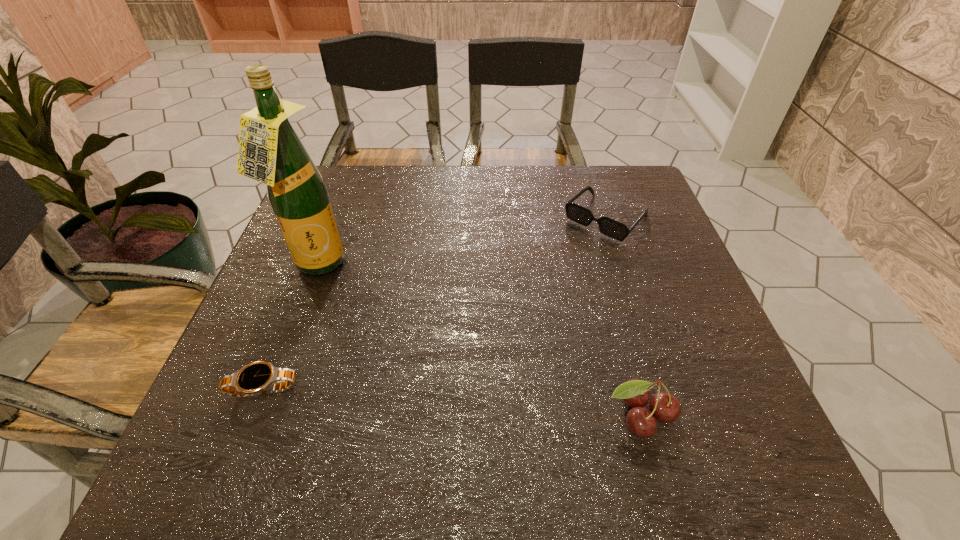
I want to click on object located at the near right corner, so click(x=665, y=407).

Find the location of a particular element. free region at the far edge of the desktop is located at coordinates (471, 212).

The image size is (960, 540). In the image, there is a desktop. Find the location of `vacant space at the near edge`. vacant space at the near edge is located at coordinates (403, 399).

The height and width of the screenshot is (540, 960). I want to click on blank space at the left edge of the desktop, so (351, 218).

Locate an element on the screen. The height and width of the screenshot is (540, 960). free location at the right edge of the desktop is located at coordinates (715, 364).

At what (x,y) coordinates should I click in order to perform the action: click on blank area at the far left corner. Please return your answer as a coordinate pair (x, y). The image size is (960, 540). Looking at the image, I should click on (367, 183).

Where is `free space at the far right corner of the desktop`? The height and width of the screenshot is (540, 960). free space at the far right corner of the desktop is located at coordinates (590, 186).

This screenshot has width=960, height=540. In the image, there is a desktop. In order to click on vacant space at the near right corner in this screenshot , I will do `click(679, 396)`.

Locate an element on the screen. This screenshot has height=540, width=960. free space between the watch and the sunglasses is located at coordinates (435, 303).

Locate an element on the screen. free point between the third shortest object and the tallest object is located at coordinates (477, 341).